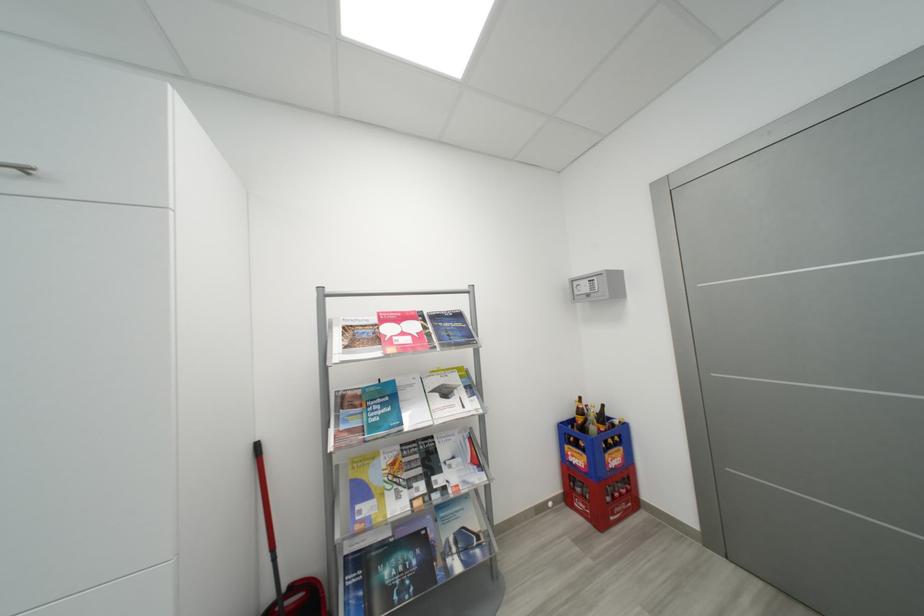
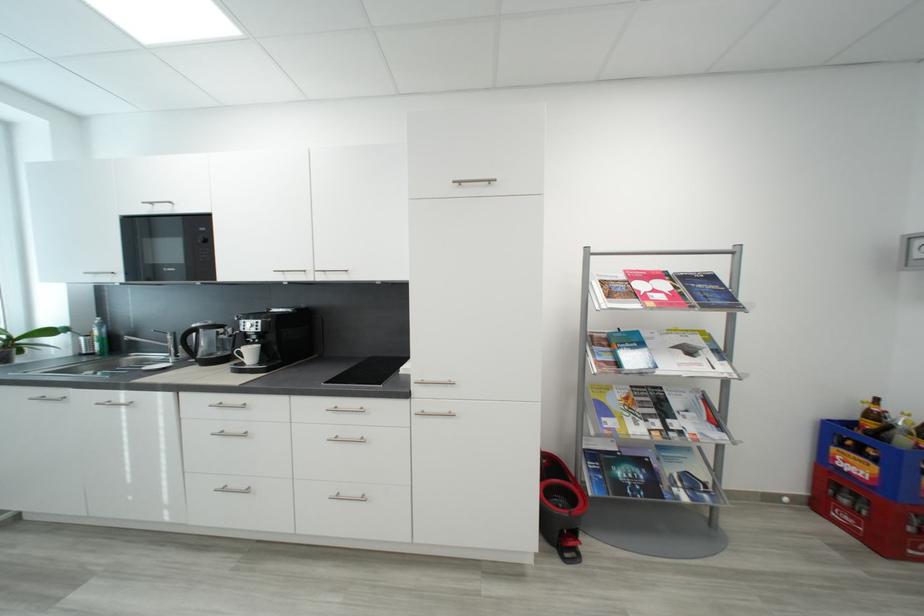
Find the pixel in the second image that matches point 588,413 in the first image.

(881, 418)